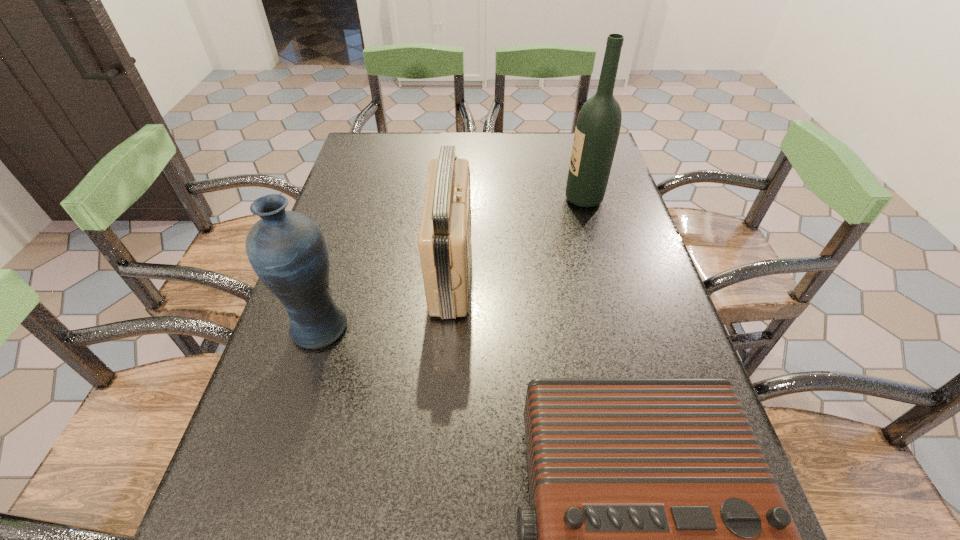
Identify which object is the closest to the third tallest object. Please provide its 2D coordinates. Your answer should be formatted as a tuple, i.e. [(x, y)], where the tuple contains the x and y coordinates of a point satisfying the conditions above.

[(287, 250)]

Locate an element on the screen. The height and width of the screenshot is (540, 960). vacant space that satisfies the following two spatial constraints: 1. on the front-facing side of the taller radio receiver; 2. on the front side of the vase is located at coordinates (447, 327).

Where is `vacant space that satisfies the following two spatial constraints: 1. on the labeled side of the farthest object; 2. on the front side of the vase`? vacant space that satisfies the following two spatial constraints: 1. on the labeled side of the farthest object; 2. on the front side of the vase is located at coordinates (618, 327).